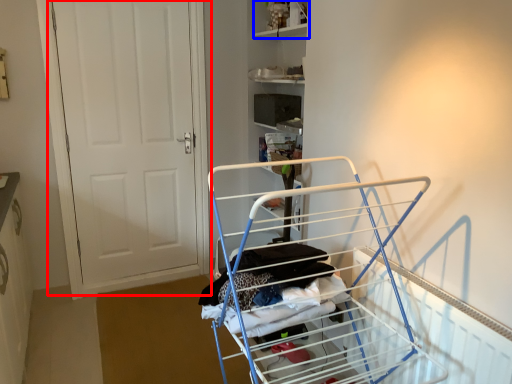
Question: Which object appears closest to the camera in this image, door (highlighted by a red box) or shelf (highlighted by a blue box)?

Choices:
 (A) door
 (B) shelf

Answer: (A)